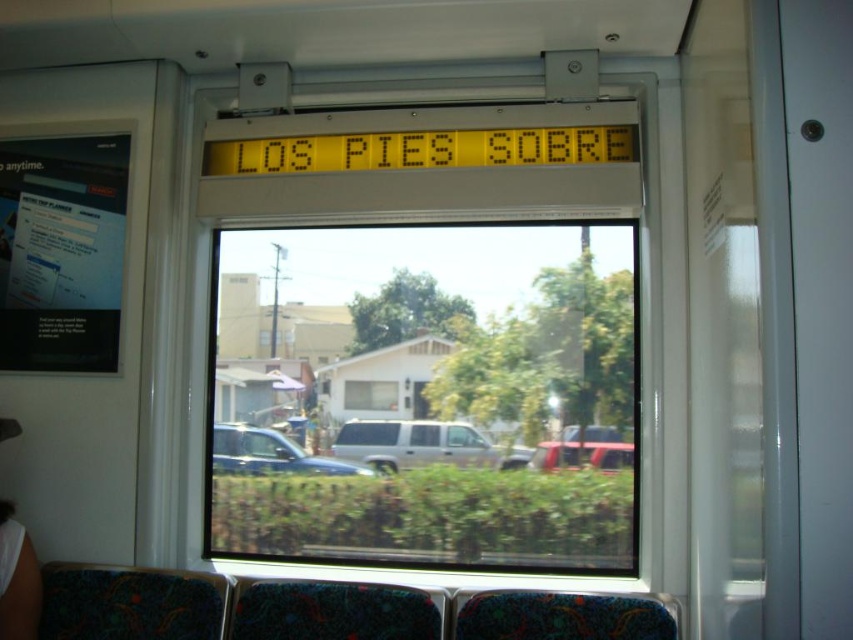
Question: Which point is farther from the camera taking this photo?

Choices:
 (A) (602, 374)
 (B) (456, 429)

Answer: (B)

Question: Does silver metallic suv at center lie behind metallic red car at center?

Choices:
 (A) yes
 (B) no

Answer: (A)

Question: Among these objects, which one is farthest from the camera?

Choices:
 (A) silver metallic suv at center
 (B) metallic silver car at center

Answer: (B)

Question: Among these objects, which one is nearest to the camera?

Choices:
 (A) metallic silver car at center
 (B) clear glass window at center

Answer: (B)

Question: Can you confirm if clear glass window at center is thinner than metallic silver car at center?

Choices:
 (A) yes
 (B) no

Answer: (B)

Question: Does clear glass window at center appear on the left side of metallic silver car at center?

Choices:
 (A) yes
 (B) no

Answer: (B)